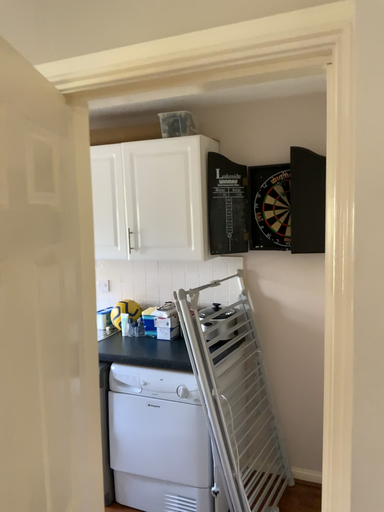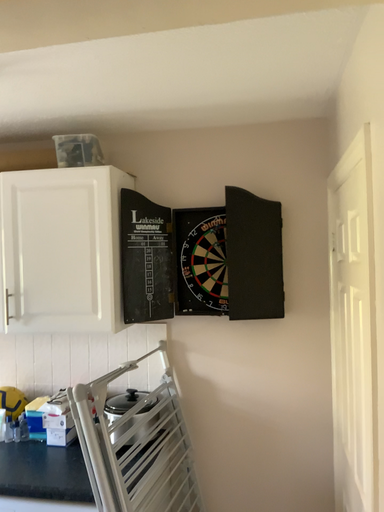
Question: Which way did the camera rotate in the video?

Choices:
 (A) rotated left
 (B) rotated right

Answer: (B)